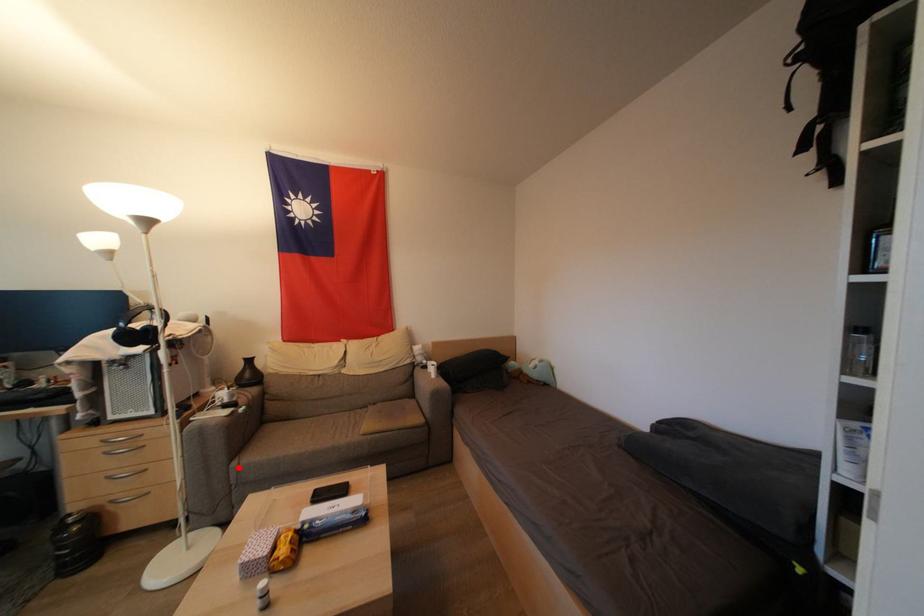
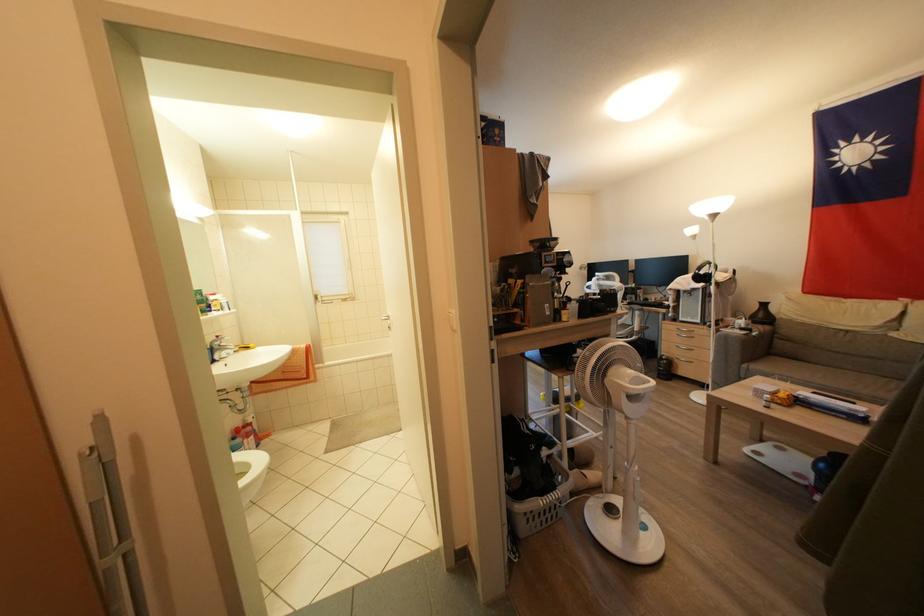
Question: I am providing you with two images of the same scene from different viewpoints. Given a red point in image1, look at the same physical point in image2. Is it:

Choices:
 (A) Closer to the viewpoint
 (B) Farther from the viewpoint

Answer: (B)